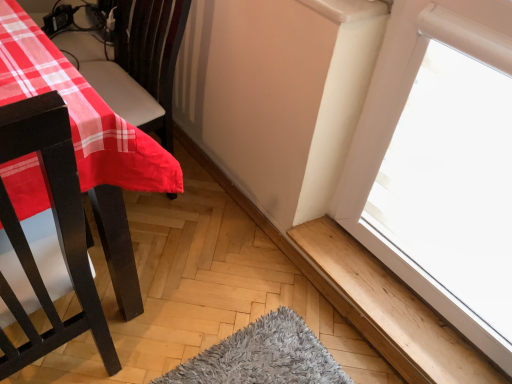
Identify the location of vacant area in front of matte plastic table at left. Image resolution: width=512 pixels, height=384 pixels. (157, 291).